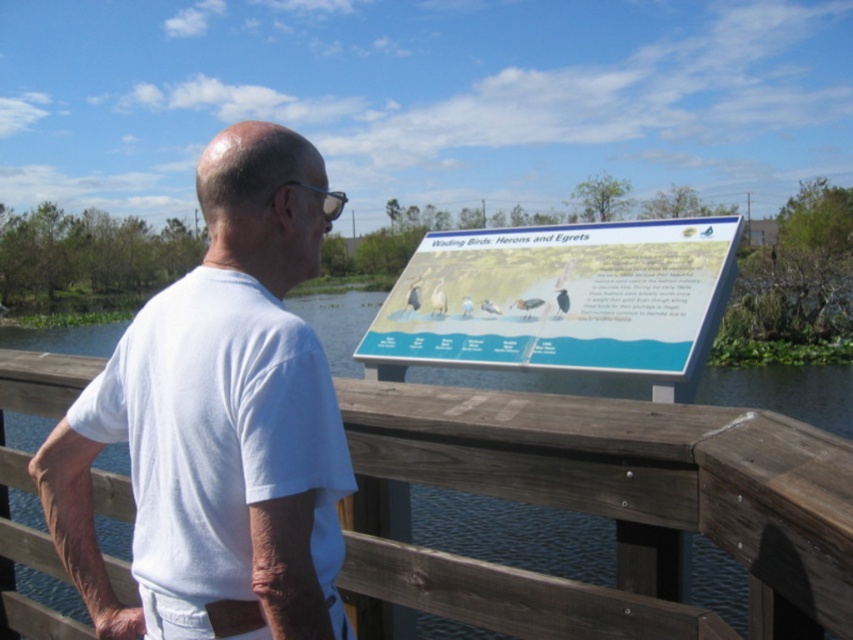
Based on the scene description, where is the white cotton shirt at center located in terms of its 2D coordinates?

The white cotton shirt at center is located at the 2D coordinates point (219, 406).

You are a photographer trying to capture both the man in the white cotton shirt at center and the blue glossy signboard at center in a single frame. Based on their positions, which object should you focus on first to ensure both are in the frame?

The white cotton shirt at center is to the left of the blue glossy signboard at center, so you should focus on the blue glossy signboard at center first to ensure both are in the frame since it is on the right side and adjusting the frame to include the left object would naturally include the right one if positioned correctly.

You are a photographer standing 1.16 meters away from the white cotton shirt at center. You want to take a clear photo of the signboard titled

The white cotton shirt at center is 1.16 meters away from the viewer. Since the photographer is exactly at that distance, they can adjust their focus to capture the signboard clearly while keeping the shirt in the frame if desired.